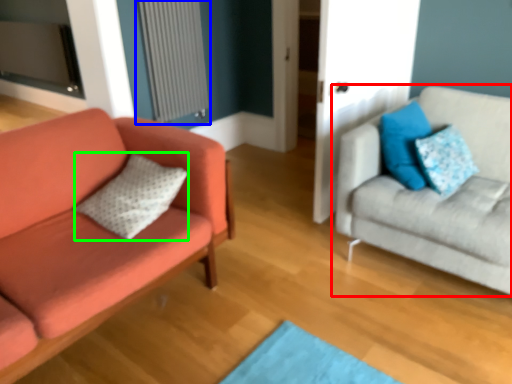
Question: Which object is the closest to the studio couch (highlighted by a red box)? Choose among these: radiator (highlighted by a blue box) or pillow (highlighted by a green box).

Choices:
 (A) radiator
 (B) pillow

Answer: (B)